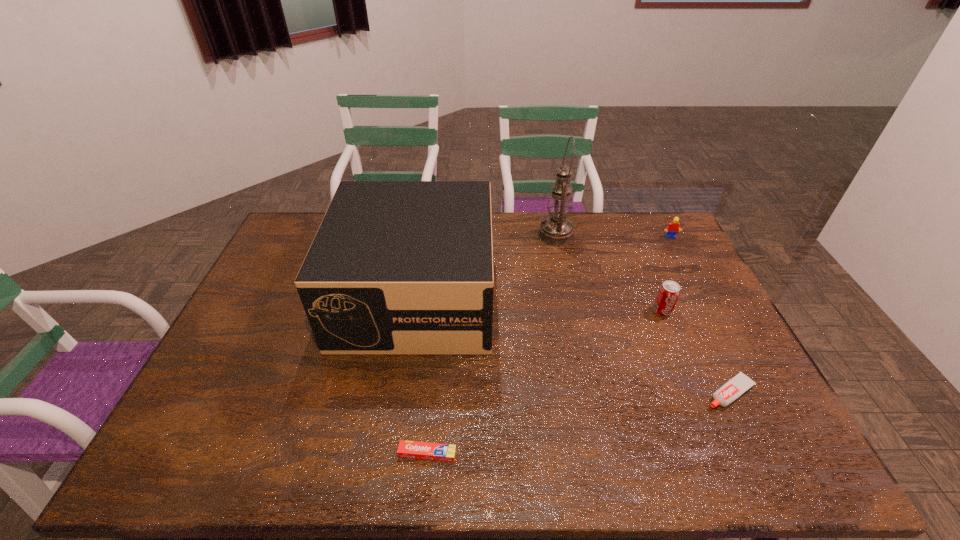
The height and width of the screenshot is (540, 960). I want to click on vacant area situated on the front-facing side of the box, so click(x=401, y=383).

The width and height of the screenshot is (960, 540). What are the coordinates of `vacant space located on the back of the soda can` in the screenshot? It's located at (640, 259).

I want to click on free spot located 0.270m on the front-facing side of the Lego, so click(x=698, y=291).

This screenshot has height=540, width=960. Identify the location of vacant space located 0.210m on the left of the farther toothpaste. (620, 393).

This screenshot has width=960, height=540. I want to click on free space located on the left of the left toothpaste, so click(x=333, y=454).

Identify the location of oil lamp that is at the far edge. (556, 230).

Locate an element on the screen. box present at the far edge is located at coordinates (396, 267).

Where is `Lego that is at the far edge`? This screenshot has height=540, width=960. Lego that is at the far edge is located at coordinates (673, 227).

Locate an element on the screen. object that is positioned at the near edge is located at coordinates (407, 449).

The image size is (960, 540). I want to click on soda can present at the right edge, so click(668, 294).